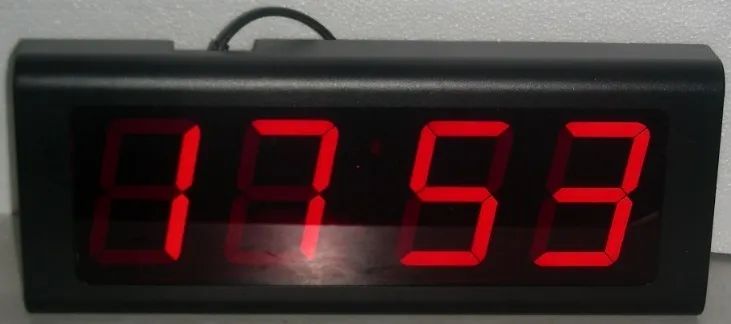
The image size is (731, 324). I want to click on light, so click(186, 146), click(330, 150), click(428, 150), click(636, 153).